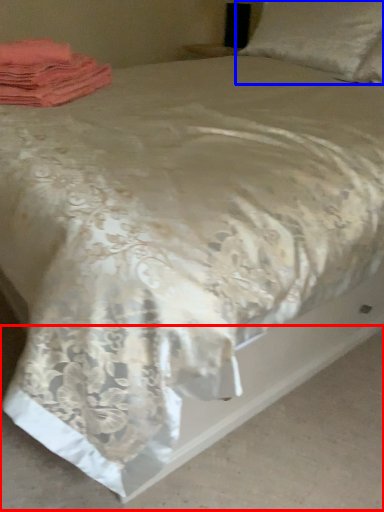
Question: Which object is further to the camera taking this photo, concrete (highlighted by a red box) or pillow (highlighted by a blue box)?

Choices:
 (A) concrete
 (B) pillow

Answer: (B)